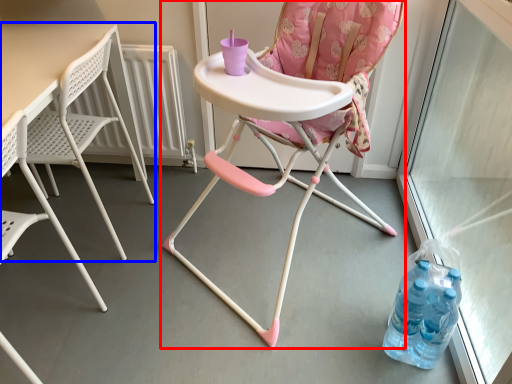
Question: Which point is further to the camera, chair (highlighted by a red box) or table (highlighted by a blue box)?

Choices:
 (A) chair
 (B) table

Answer: (B)